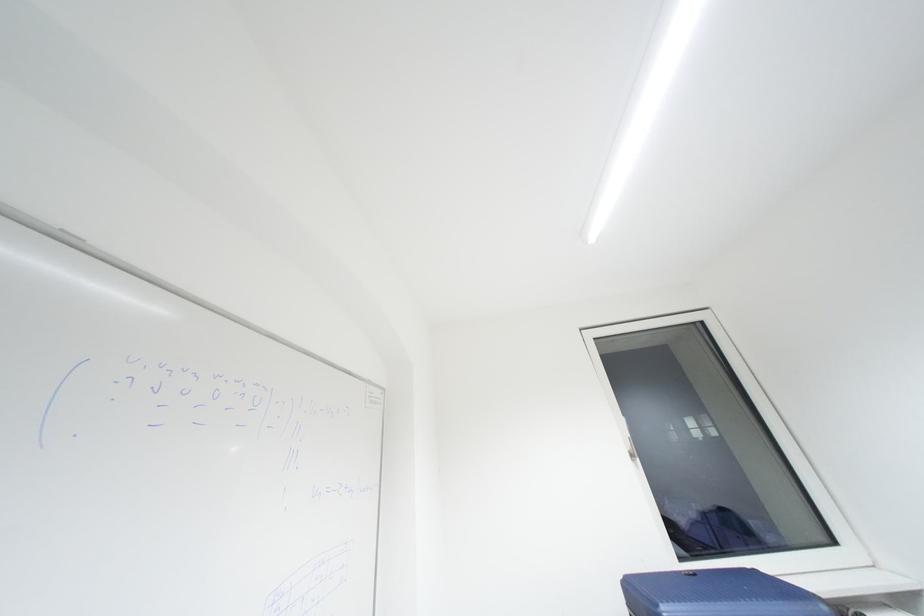
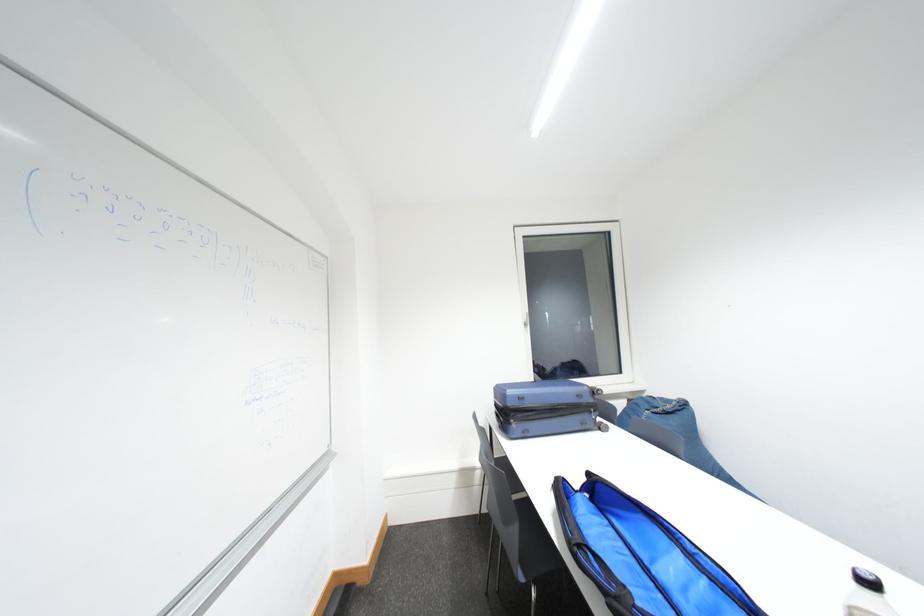
What movement of the cameraman would produce the second image?

The cameraman walked toward right, backward.